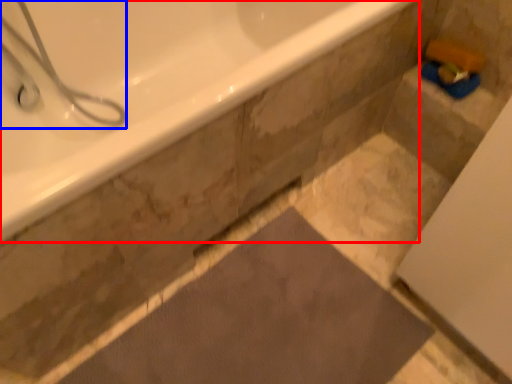
Question: Among these objects, which one is farthest to the camera, bathtub (highlighted by a red box) or shower (highlighted by a blue box)?

Choices:
 (A) bathtub
 (B) shower

Answer: (B)